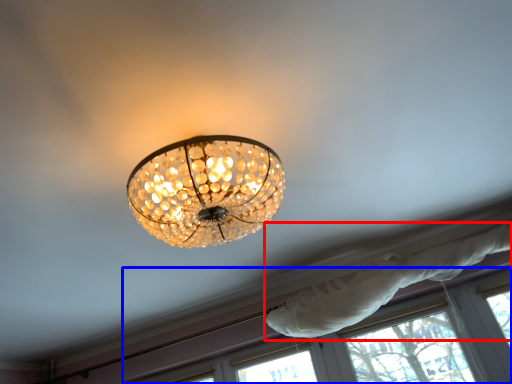
Question: Among these objects, which one is nearest to the camera, curtain (highlighted by a red box) or window (highlighted by a blue box)?

Choices:
 (A) curtain
 (B) window

Answer: (A)